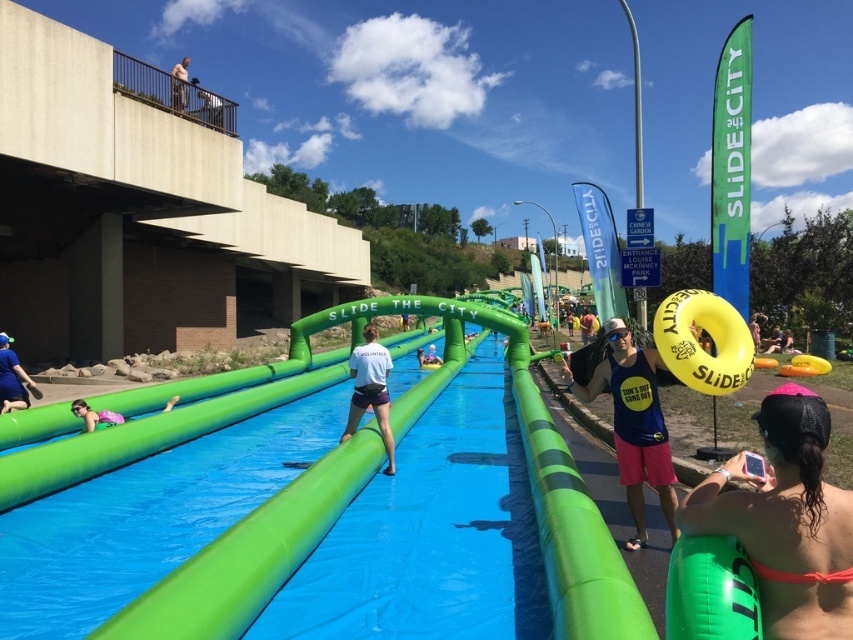
Is blue fabric tank top at center wider than skinny jeans at upper left?

In fact, blue fabric tank top at center might be narrower than skinny jeans at upper left.

Does blue fabric tank top at center come in front of skinny jeans at upper left?

Yes.

Between point (566, 381) and point (172, 100), which one is positioned behind?

The point (172, 100) is more distant.

Locate an element on the screen. blue fabric tank top at center is located at coordinates (633, 422).

Can you confirm if pink fabric bikini at lower right is positioned to the right of blue fabric shirt at lower left?

Correct, you'll find pink fabric bikini at lower right to the right of blue fabric shirt at lower left.

Can you confirm if pink fabric bikini at lower right is positioned above blue fabric shirt at lower left?

Indeed, pink fabric bikini at lower right is positioned over blue fabric shirt at lower left.

The height and width of the screenshot is (640, 853). I want to click on pink fabric bikini at lower right, so click(785, 518).

Find the location of a particular element. The width and height of the screenshot is (853, 640). pink fabric bikini at lower right is located at coordinates (785, 518).

Between white matte shirt at center and light blue fabric tube at center, which one is positioned lower?

light blue fabric tube at center is below.

Who is positioned more to the left, white matte shirt at center or light blue fabric tube at center?

white matte shirt at center is more to the left.

Where is `white matte shirt at center`? This screenshot has width=853, height=640. white matte shirt at center is located at coordinates (370, 388).